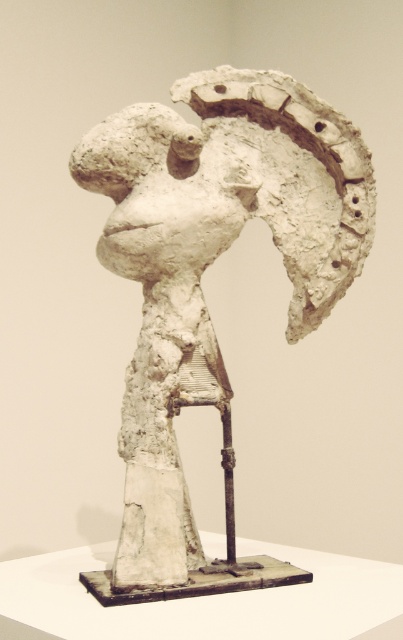
Question: Is white clay sculpture at center below white clay head at center?

Choices:
 (A) yes
 (B) no

Answer: (A)

Question: Does white clay sculpture at center appear on the right side of white clay head at center?

Choices:
 (A) no
 (B) yes

Answer: (B)

Question: Which of the following is the farthest from the observer?

Choices:
 (A) white clay sculpture at center
 (B) white clay head at center

Answer: (B)

Question: Which point appears farthest from the camera in this image?

Choices:
 (A) (103, 192)
 (B) (126, 586)

Answer: (A)

Question: Can you confirm if white clay sculpture at center is positioned below white clay head at center?

Choices:
 (A) no
 (B) yes

Answer: (B)